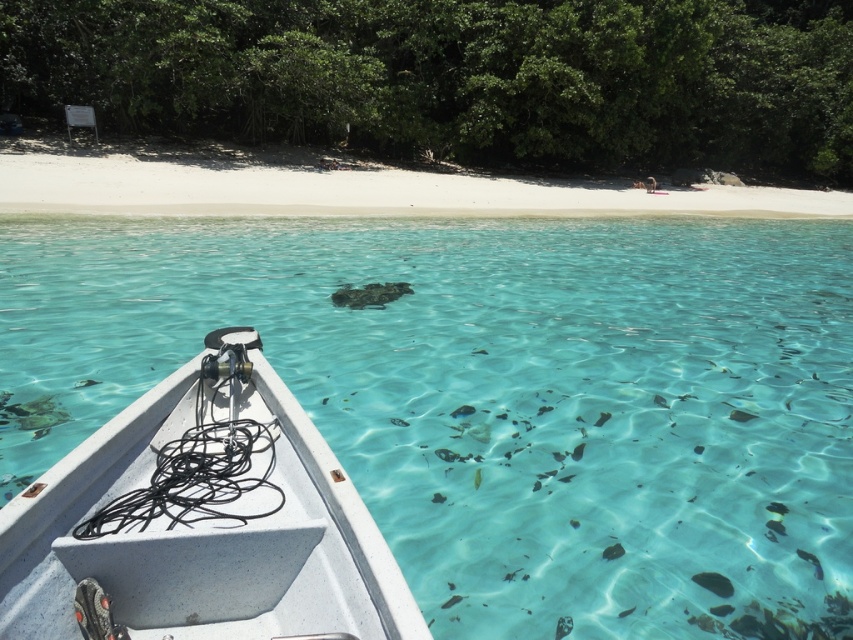
You are in a boat and want to throw a fishing line to one of the two points in the water. The first point is at coordinates point (x=271, y=509) and the second is at point (x=714, y=208). Which point is closer to you so that you can reach it more easily?

Point (x=271, y=509) is closer to the viewer than point (x=714, y=208), so you can reach it more easily.